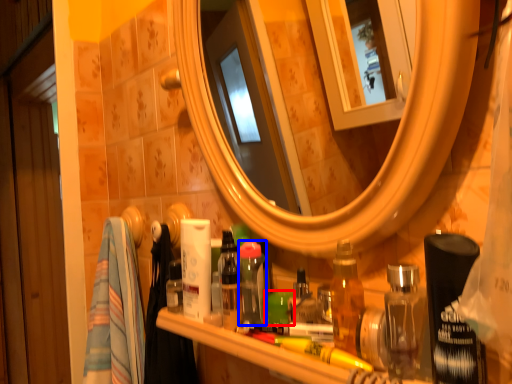
Question: Which point is further to the camera, toiletry (highlighted by a red box) or toiletry (highlighted by a blue box)?

Choices:
 (A) toiletry
 (B) toiletry

Answer: (B)